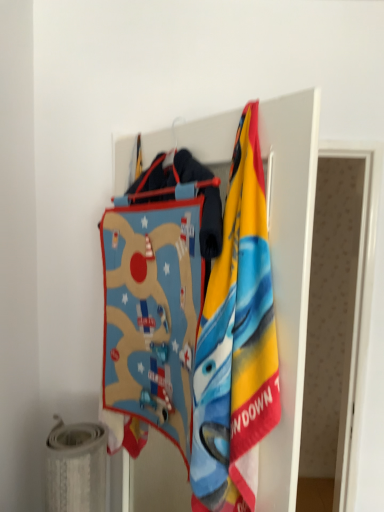
Where is `textured fabric organizer at center`? textured fabric organizer at center is located at coordinates (289, 276).

What do you see at coordinates (289, 276) in the screenshot? Image resolution: width=384 pixels, height=512 pixels. I see `textured fabric organizer at center` at bounding box center [289, 276].

The width and height of the screenshot is (384, 512). Find the location of `textured fabric organizer at center`. textured fabric organizer at center is located at coordinates (289, 276).